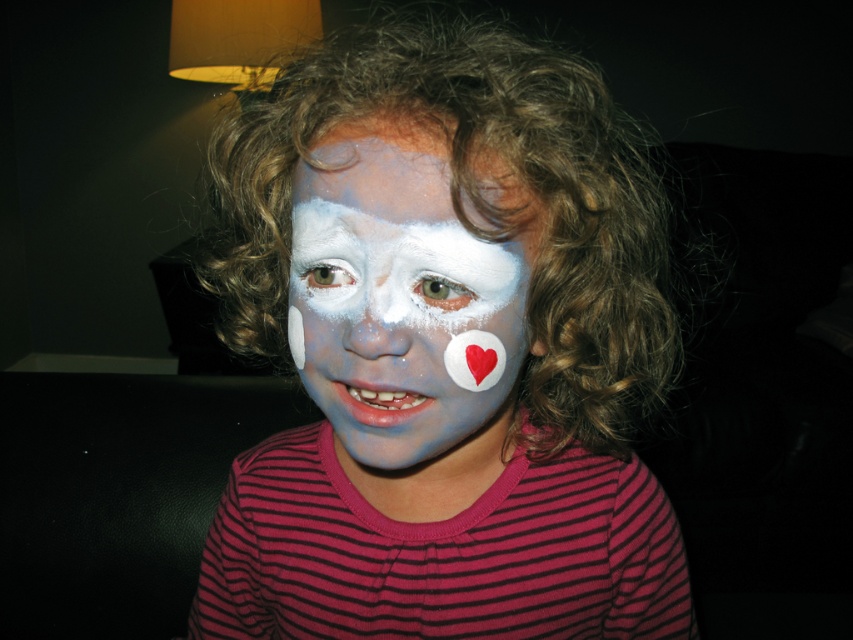
Question: Which of the following is the closest to the observer?

Choices:
 (A) (485, 310)
 (B) (370, 321)
 (C) (660, 237)

Answer: (B)

Question: Which object is closer to the camera taking this photo?

Choices:
 (A) white matte face paint at center
 (B) white matte nose at center

Answer: (A)

Question: From the image, what is the correct spatial relationship of white matte face paint at center in relation to white matte nose at center?

Choices:
 (A) left
 (B) right

Answer: (B)

Question: Estimate the real-world distances between objects in this image. Which object is farther from the curly brown hair at center?

Choices:
 (A) white matte nose at center
 (B) white matte face paint at center

Answer: (A)

Question: Does white matte face paint at center have a greater width compared to white matte nose at center?

Choices:
 (A) no
 (B) yes

Answer: (B)

Question: Is curly brown hair at center positioned in front of white matte nose at center?

Choices:
 (A) no
 (B) yes

Answer: (A)